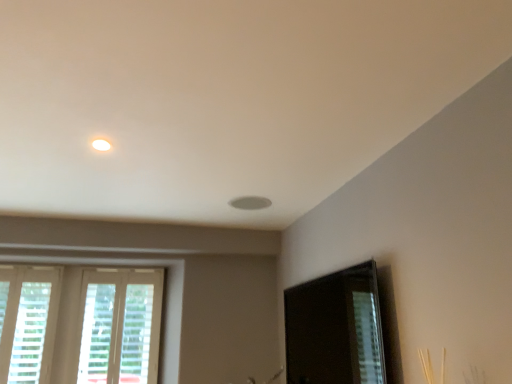
Question: Is white wooden window at lower left, which ranks as the first window in right-to-left order, to the right of transparent glass screen door at lower right from the viewer's perspective?

Choices:
 (A) no
 (B) yes

Answer: (A)

Question: Is white wooden window at lower left, which ranks as the first window in right-to-left order, taller than transparent glass screen door at lower right?

Choices:
 (A) yes
 (B) no

Answer: (A)

Question: Is white wooden window at lower left, the second window when ordered from left to right, positioned behind transparent glass screen door at lower right?

Choices:
 (A) yes
 (B) no

Answer: (A)

Question: From the image's perspective, is white wooden window at lower left, the second window when ordered from left to right, on transparent glass screen door at lower right?

Choices:
 (A) no
 (B) yes

Answer: (A)

Question: Is white wooden window at lower left, the second window when ordered from left to right, shorter than transparent glass screen door at lower right?

Choices:
 (A) yes
 (B) no

Answer: (B)

Question: Based on their positions, is white textured blinds at lower left, the second window when ordered from right to left, located to the left or right of white wooden window at lower left, which ranks as the first window in right-to-left order?

Choices:
 (A) left
 (B) right

Answer: (A)

Question: From the image's perspective, is white textured blinds at lower left, which appears as the 1th window when viewed from the left, above or below white wooden window at lower left, the second window when ordered from left to right?

Choices:
 (A) above
 (B) below

Answer: (A)

Question: Which is correct: white textured blinds at lower left, which appears as the 1th window when viewed from the left, is inside white wooden window at lower left, the second window when ordered from left to right, or outside of it?

Choices:
 (A) outside
 (B) inside

Answer: (A)

Question: Does point (19, 349) appear closer or farther from the camera than point (119, 269)?

Choices:
 (A) farther
 (B) closer

Answer: (B)

Question: Is white wooden window at lower left, the second window when ordered from left to right, in front of or behind transparent glass screen door at lower right in the image?

Choices:
 (A) front
 (B) behind

Answer: (B)

Question: Considering the positions of white wooden window at lower left, which ranks as the first window in right-to-left order, and transparent glass screen door at lower right in the image, is white wooden window at lower left, which ranks as the first window in right-to-left order, bigger or smaller than transparent glass screen door at lower right?

Choices:
 (A) big
 (B) small

Answer: (B)

Question: Considering the relative positions of white wooden window at lower left, the second window when ordered from left to right, and transparent glass screen door at lower right in the image provided, is white wooden window at lower left, the second window when ordered from left to right, to the left or to the right of transparent glass screen door at lower right?

Choices:
 (A) right
 (B) left

Answer: (B)

Question: From their relative heights in the image, would you say white wooden window at lower left, the second window when ordered from left to right, is taller or shorter than transparent glass screen door at lower right?

Choices:
 (A) tall
 (B) short

Answer: (A)

Question: In terms of width, does white wooden window at lower left, which ranks as the first window in right-to-left order, look wider or thinner when compared to white textured blinds at lower left, which appears as the 1th window when viewed from the left?

Choices:
 (A) wide
 (B) thin

Answer: (A)

Question: Is point (159, 316) positioned closer to the camera than point (50, 316)?

Choices:
 (A) closer
 (B) farther

Answer: (B)